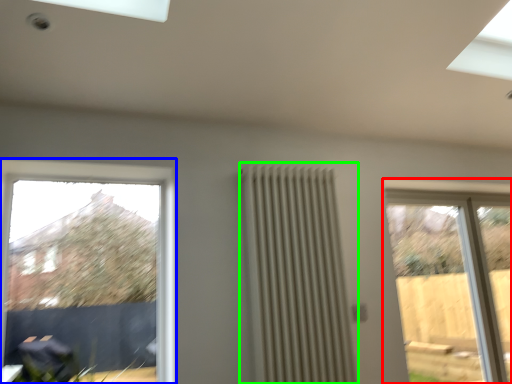
Question: Estimate the real-world distances between objects in this image. Which object is farther from window (highlighted by a red box), window (highlighted by a blue box) or radiator (highlighted by a green box)?

Choices:
 (A) window
 (B) radiator

Answer: (A)